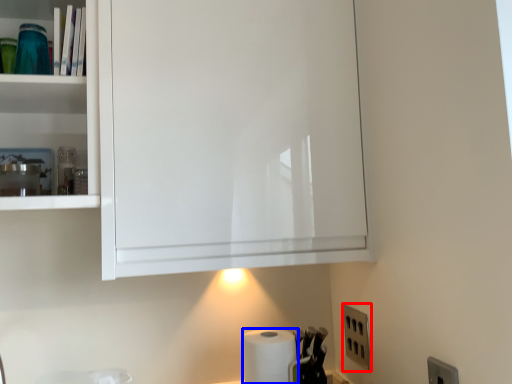
Question: Which object is closer to the camera taking this photo, electric outlet (highlighted by a red box) or paper towel (highlighted by a blue box)?

Choices:
 (A) electric outlet
 (B) paper towel

Answer: (B)